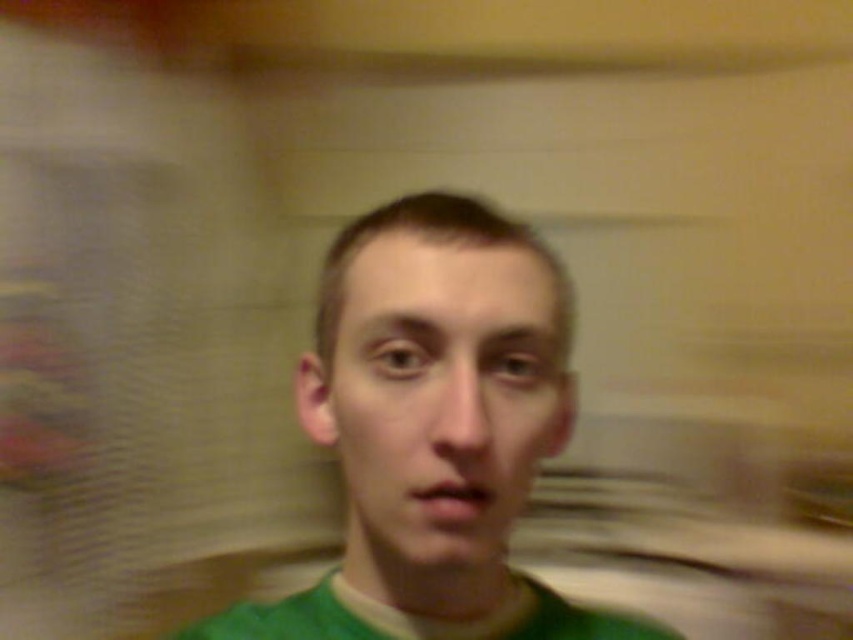
Question: Is the position of green matte shirt at center less distant than that of green matte face at center?

Choices:
 (A) yes
 (B) no

Answer: (B)

Question: Which point is closer to the camera?

Choices:
 (A) (508, 508)
 (B) (490, 212)

Answer: (A)

Question: Is green matte shirt at center thinner than green matte face at center?

Choices:
 (A) no
 (B) yes

Answer: (A)

Question: Which object appears closest to the camera in this image?

Choices:
 (A) green matte shirt at center
 (B) green matte face at center

Answer: (B)

Question: Which of the following is the farthest from the observer?

Choices:
 (A) (422, 323)
 (B) (521, 387)

Answer: (B)

Question: Is green matte shirt at center to the right of green matte face at center from the viewer's perspective?

Choices:
 (A) yes
 (B) no

Answer: (A)